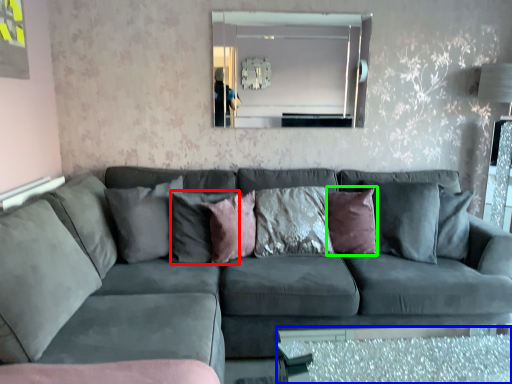
Question: Considering the real-world distances, which object is farthest from pillow (highlighted by a red box)? glass table (highlighted by a blue box) or pillow (highlighted by a green box)?

Choices:
 (A) glass table
 (B) pillow

Answer: (A)